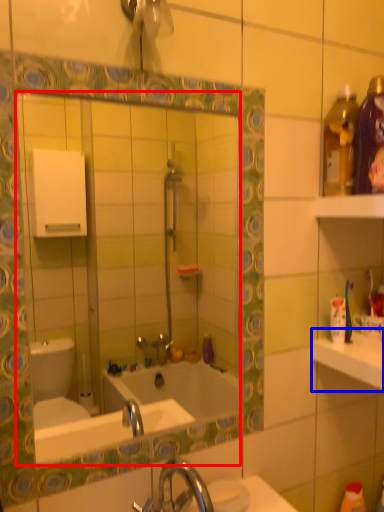
Question: Which of the following is the farthest to the observer, mirror (highlighted by a red box) or counter top (highlighted by a blue box)?

Choices:
 (A) mirror
 (B) counter top

Answer: (B)